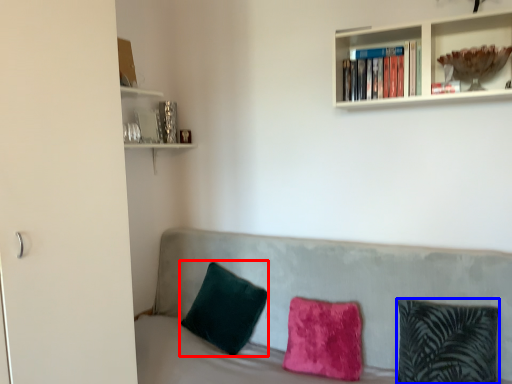
Question: Which object is further to the camera taking this photo, pillow (highlighted by a red box) or pillow (highlighted by a blue box)?

Choices:
 (A) pillow
 (B) pillow

Answer: (A)